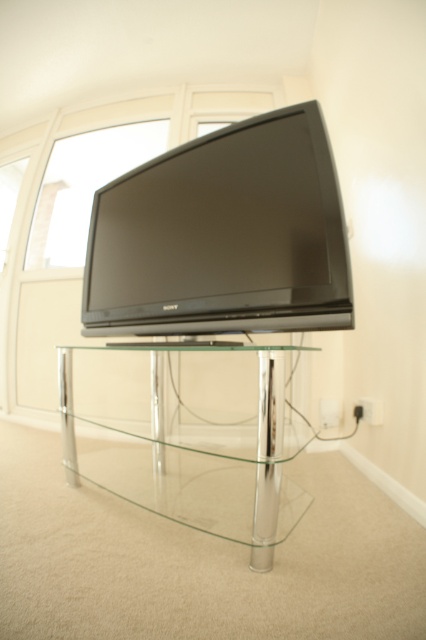
Question: Is black glossy flat screen tv at center positioned behind transparent glass table at center?

Choices:
 (A) no
 (B) yes

Answer: (B)

Question: Can you confirm if black glossy flat screen tv at center is positioned to the right of transparent glass table at center?

Choices:
 (A) no
 (B) yes

Answer: (A)

Question: Can you confirm if black glossy flat screen tv at center is positioned to the left of transparent glass table at center?

Choices:
 (A) yes
 (B) no

Answer: (A)

Question: Which point is closer to the camera taking this photo?

Choices:
 (A) (103, 188)
 (B) (166, 349)

Answer: (B)